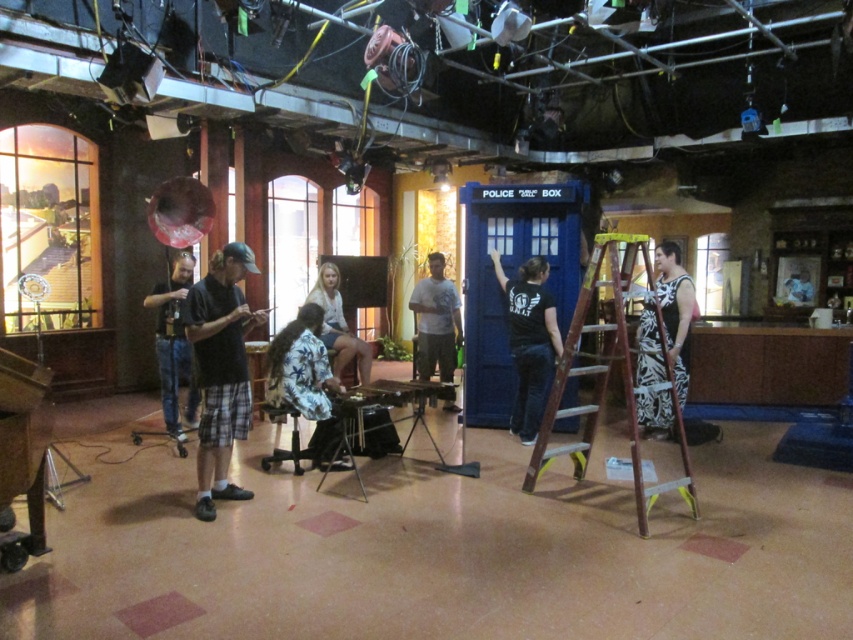
Who is more forward, (546,349) or (328,380)?

Positioned in front is point (328,380).

Who is more forward, (x=509, y=426) or (x=317, y=369)?

Point (x=317, y=369) is in front.

In order to click on black matte shirt at center in this screenshot , I will do `click(529, 340)`.

Is black and white striped dress at right in front of white matte shirt at center?

Yes, black and white striped dress at right is closer to the viewer.

This screenshot has height=640, width=853. What do you see at coordinates (674, 308) in the screenshot?
I see `black and white striped dress at right` at bounding box center [674, 308].

Identify the location of black and white striped dress at right. (674, 308).

Which is above, brown wooden ladder at center or black matte shirt at center?

black matte shirt at center is higher up.

Is point (605, 234) closer to viewer compared to point (523, 371)?

Yes, point (605, 234) is closer to viewer.

You are a GUI agent. You are given a task and a screenshot of the screen. Output one action in this format:
    pyautogui.click(x=<x>, y=<y>)
    Task: Click on the brown wooden ladder at center
    This screenshot has height=640, width=853.
    Given the screenshot: What is the action you would take?
    pyautogui.click(x=607, y=380)